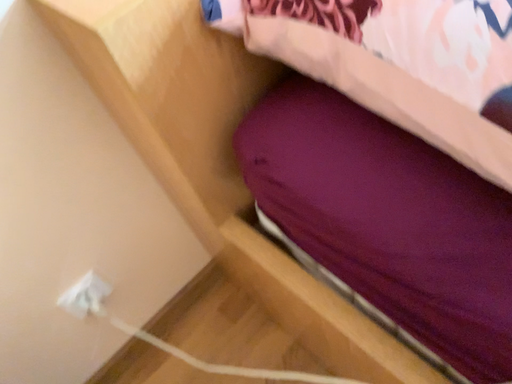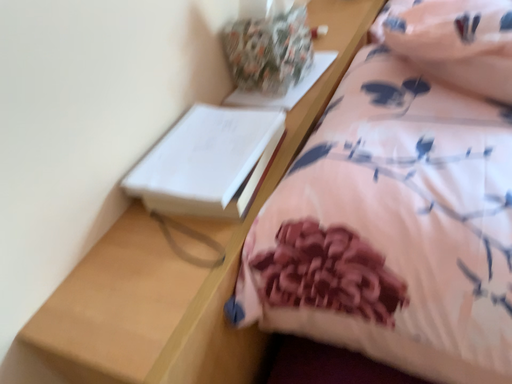
Question: Which way did the camera rotate in the video?

Choices:
 (A) rotated upward
 (B) rotated downward

Answer: (A)